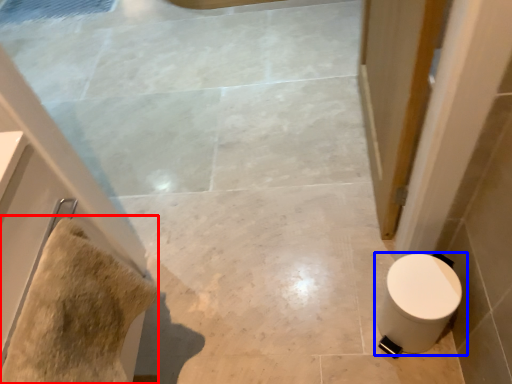
Question: Among these objects, which one is farthest to the camera, material (highlighted by a red box) or toilet (highlighted by a blue box)?

Choices:
 (A) material
 (B) toilet

Answer: (B)